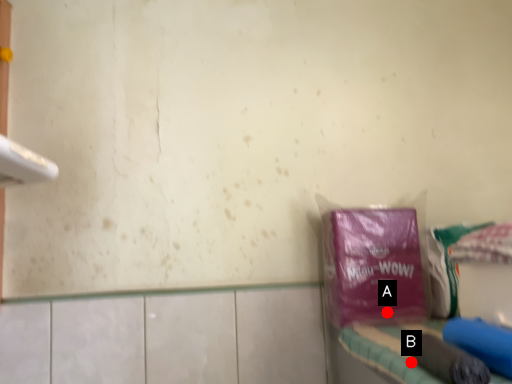
Question: Two points are circled on the image, labeled by A and B beside each circle. Which of the following is the closest to the observer?

Choices:
 (A) A is closer
 (B) B is closer

Answer: (B)